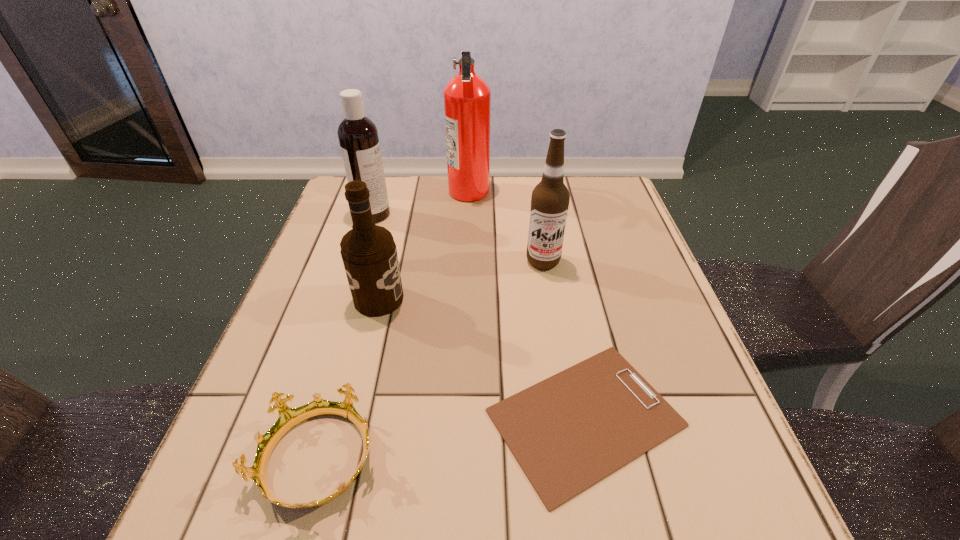
Identify the location of free space located on the label of the farther alcohol. The width and height of the screenshot is (960, 540). (550, 303).

Where is `free space located 0.100m on the label of the left alcohol`? The width and height of the screenshot is (960, 540). free space located 0.100m on the label of the left alcohol is located at coordinates (448, 299).

Where is `vacant space located on the right of the crown`? The width and height of the screenshot is (960, 540). vacant space located on the right of the crown is located at coordinates (417, 460).

At what (x,y) coordinates should I click in order to perform the action: click on free spot located on the left of the clipboard. Please return your answer as a coordinate pair (x, y). Looking at the image, I should click on (270, 418).

In order to click on fire extinguisher situated at the far edge in this screenshot , I will do `click(467, 97)`.

Locate an element on the screen. This screenshot has height=540, width=960. dishwasher detergent at the far edge is located at coordinates coord(358,137).

Identify the location of crown located in the near edge section of the desktop. The height and width of the screenshot is (540, 960). (288, 418).

Find the location of `clipboard that is at the near edge`. clipboard that is at the near edge is located at coordinates (568, 432).

The height and width of the screenshot is (540, 960). Identify the location of dishwasher detergent present at the left edge. (358, 137).

Find the location of a particular element. The image size is (960, 540). alcohol that is at the left edge is located at coordinates (369, 254).